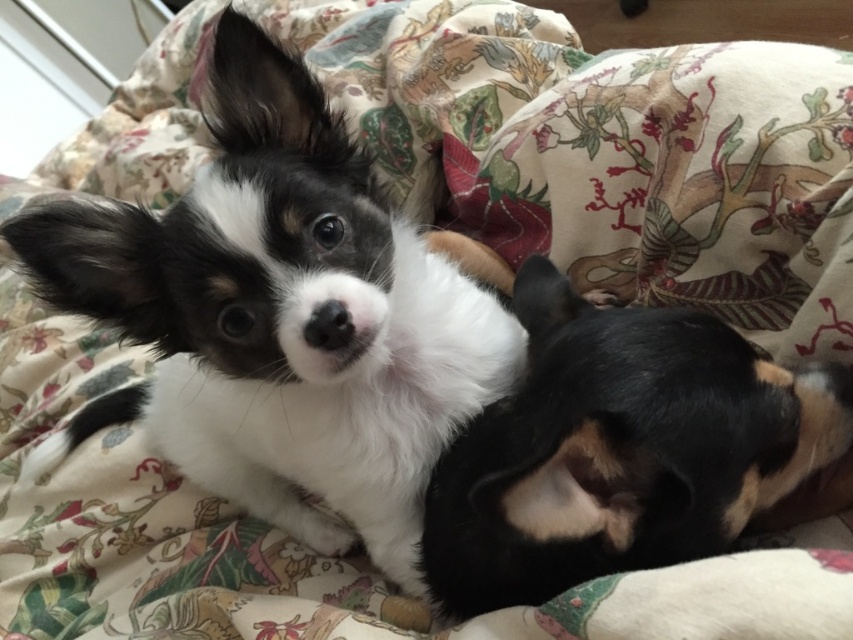
Does point (209, 182) come in front of point (654, 474)?

That is False.

Who is positioned more to the left, black and white fur at upper left or black soft fur dog at lower right?

Positioned to the left is black and white fur at upper left.

Is point (200, 416) farther from viewer compared to point (424, 563)?

Yes, point (200, 416) is farther from viewer.

This screenshot has height=640, width=853. Find the location of `black and white fur at upper left`. black and white fur at upper left is located at coordinates (280, 317).